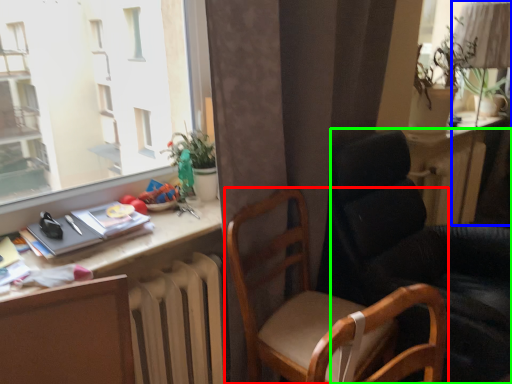
Question: Based on their relative distances, which object is nearer to chair (highlighted by a red box)? Choose from table lamp (highlighted by a blue box) and chair (highlighted by a green box).

Choices:
 (A) table lamp
 (B) chair

Answer: (B)